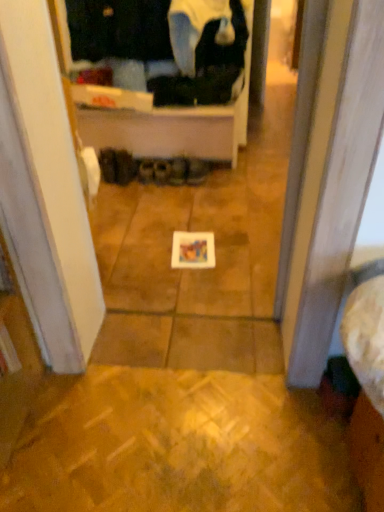
This screenshot has width=384, height=512. What are the coordinates of `free spot in front of brown suede boot at center, which appears as the fifth footwear when viewed from the right` in the screenshot? It's located at (128, 190).